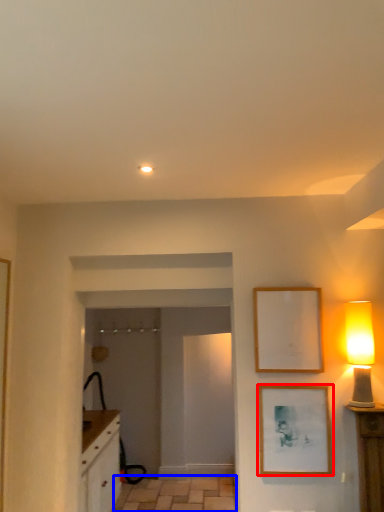
Question: Which of the following is the closest to the observer, picture frame (highlighted by a red box) or tile (highlighted by a blue box)?

Choices:
 (A) picture frame
 (B) tile

Answer: (A)